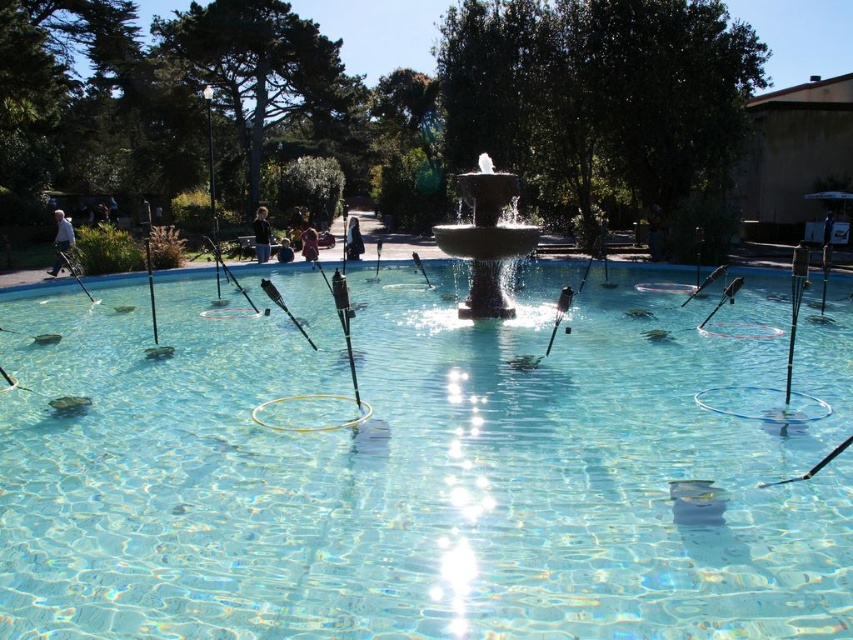
Is point (521, 225) positioned behind point (282, 253)?

No, (521, 225) is in front of (282, 253).

At what (x,y) coordinates should I click in order to perform the action: click on polished stone fountain at center. Please return your answer as a coordinate pair (x, y). Looking at the image, I should click on pyautogui.click(x=486, y=237).

Measure the distance between point (264, 257) and camera.

Point (264, 257) is 17.79 meters from camera.

Can you confirm if dark brown leather jacket at center is taller than dark blue jeans at center?

Yes.

At what (x,y) coordinates should I click in order to perform the action: click on dark brown leather jacket at center. Please return your answer as a coordinate pair (x, y). This screenshot has width=853, height=640. Looking at the image, I should click on (260, 234).

What are the coordinates of `clear glass swimming pool at center` in the screenshot? It's located at (415, 474).

At what (x,y) coordinates should I click in order to perform the action: click on clear glass swimming pool at center. Please return your answer as a coordinate pair (x, y). Looking at the image, I should click on (415, 474).